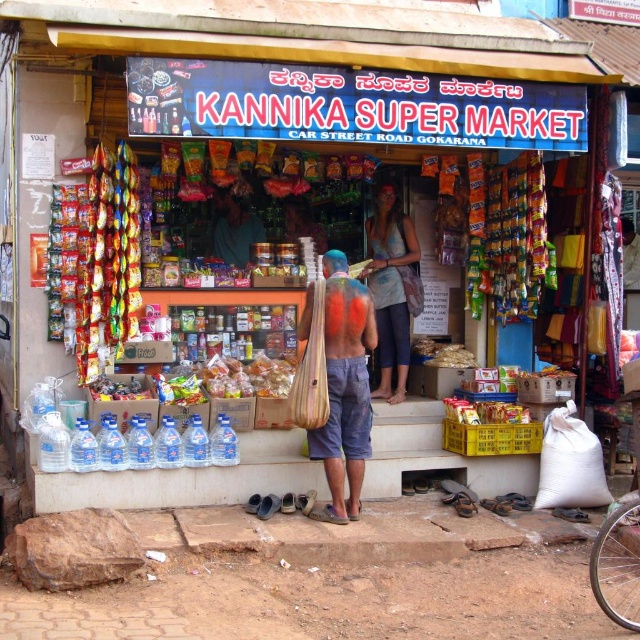
You are a customer at the Kannika Super Market and want to pick up both the striped fabric bag at center and the matte plastic snack at center. Which item should you reach for first to avoid blocking the other?

You should reach for the striped fabric bag at center first since it is in front of the matte plastic snack at center, making it easier to access without obstructing the snack.